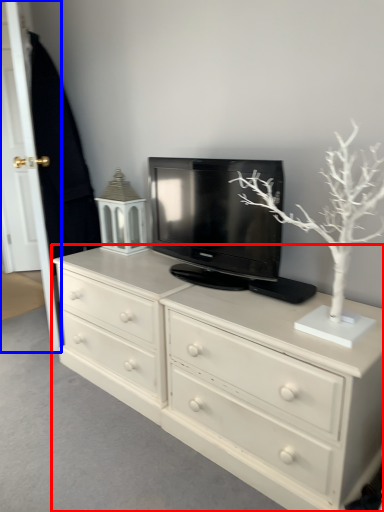
Question: Among these objects, which one is farthest to the camera, chest of drawers (highlighted by a red box) or door (highlighted by a blue box)?

Choices:
 (A) chest of drawers
 (B) door

Answer: (B)